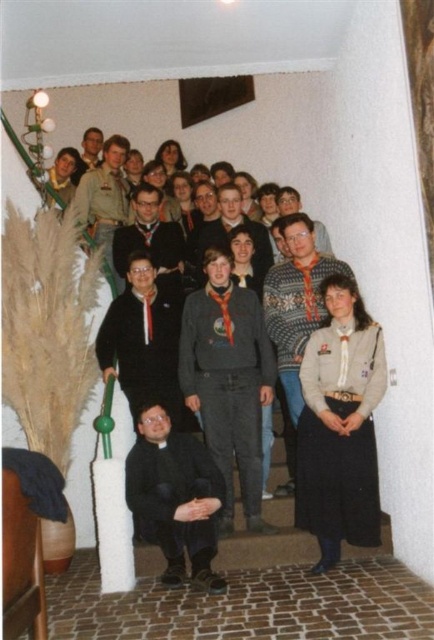
Question: Is matte black sweater at center to the left of gray wool sweater at center from the viewer's perspective?

Choices:
 (A) yes
 (B) no

Answer: (A)

Question: Which point is closer to the camera?

Choices:
 (A) (328, 236)
 (B) (247, 339)

Answer: (B)

Question: Which is farther from the dark gray sweater at center?

Choices:
 (A) white cotton shirt at center
 (B) matte khaki shirt at upper left

Answer: (B)

Question: Is white cotton shirt at center to the left of matte black sweater at center from the viewer's perspective?

Choices:
 (A) yes
 (B) no

Answer: (B)

Question: Estimate the real-world distances between objects in this image. Which object is farther from the white cotton shirt at center?

Choices:
 (A) black matte priest's robe at lower center
 (B) matte khaki shirt at upper left

Answer: (B)

Question: Is camouflage uniform at center above matte gray sweater at center?

Choices:
 (A) no
 (B) yes

Answer: (B)